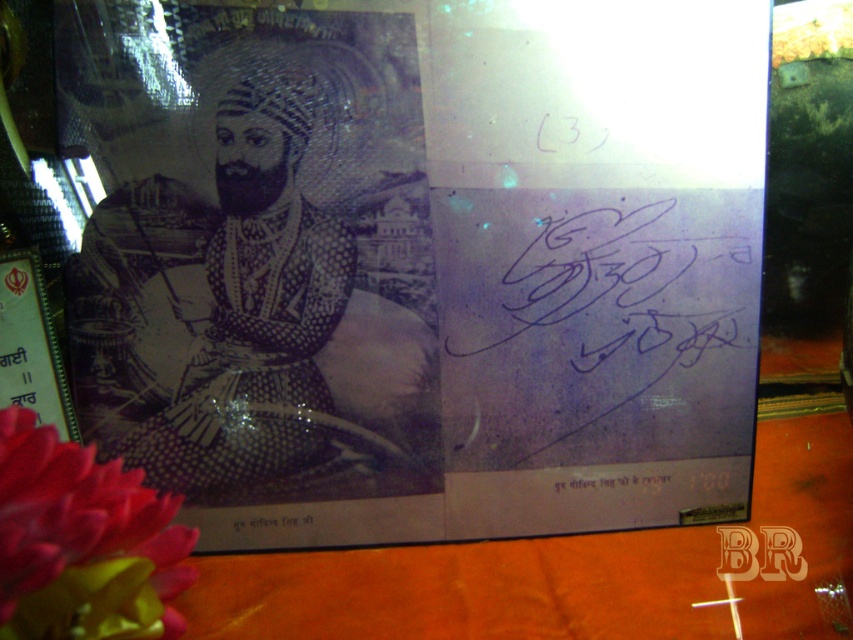
Question: Is matte pink petals at lower left positioned at the back of black ink signature at lower center?

Choices:
 (A) no
 (B) yes

Answer: (A)

Question: Considering the relative positions of black paper portrait at upper left and black ink signature at lower center in the image provided, where is black paper portrait at upper left located with respect to black ink signature at lower center?

Choices:
 (A) above
 (B) below

Answer: (A)

Question: Can you confirm if matte pink petals at lower left is wider than black ink signature at lower center?

Choices:
 (A) yes
 (B) no

Answer: (A)

Question: Which object is the closest to the black paper portrait at upper left?

Choices:
 (A) black ink signature at lower center
 (B) matte pink petals at lower left

Answer: (A)

Question: Based on their relative distances, which object is nearer to the black ink signature at lower center?

Choices:
 (A) matte pink petals at lower left
 (B) black paper portrait at upper left

Answer: (B)

Question: Which point is farther to the camera?

Choices:
 (A) matte pink petals at lower left
 (B) black ink signature at lower center
 (C) black paper portrait at upper left

Answer: (B)